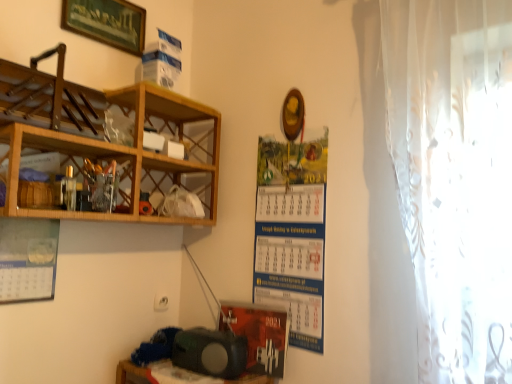
Question: From a real-world perspective, is wooden at left, placed as the second shelf when sorted from bottom to top, located beneath matte black speaker at lower center?

Choices:
 (A) yes
 (B) no

Answer: (B)

Question: From a real-world perspective, is wooden at left, placed as the second shelf when sorted from bottom to top, physically above matte black speaker at lower center?

Choices:
 (A) yes
 (B) no

Answer: (A)

Question: Is wooden at left, placed as the second shelf when sorted from bottom to top, turned away from matte black speaker at lower center?

Choices:
 (A) yes
 (B) no

Answer: (B)

Question: Does wooden at left, the first shelf in the top-to-bottom sequence, have a larger size compared to matte black speaker at lower center?

Choices:
 (A) yes
 (B) no

Answer: (A)

Question: Is wooden at left, the first shelf in the top-to-bottom sequence, shorter than matte black speaker at lower center?

Choices:
 (A) yes
 (B) no

Answer: (B)

Question: Can matte black speaker at lower center be found inside wooden at left, the first shelf in the top-to-bottom sequence?

Choices:
 (A) no
 (B) yes

Answer: (A)

Question: Would you say wooden at left, the 1th shelf ordered from the bottom, is a long distance from wooden framed picture at upper left?

Choices:
 (A) no
 (B) yes

Answer: (A)

Question: From a real-world perspective, is wooden at left, the 1th shelf ordered from the bottom, positioned over wooden framed picture at upper left based on gravity?

Choices:
 (A) yes
 (B) no

Answer: (B)

Question: Is wooden at left, the 1th shelf ordered from the bottom, taller than wooden framed picture at upper left?

Choices:
 (A) yes
 (B) no

Answer: (A)

Question: Can wooden framed picture at upper left be found inside wooden at left, the 1th shelf ordered from the bottom?

Choices:
 (A) no
 (B) yes

Answer: (A)

Question: From a real-world perspective, is wooden at left, the 2th shelf positioned from the top, beneath wooden framed picture at upper left?

Choices:
 (A) yes
 (B) no

Answer: (A)

Question: Considering the relative sizes of wooden at left, the 1th shelf ordered from the bottom, and wooden framed picture at upper left in the image provided, is wooden at left, the 1th shelf ordered from the bottom, wider than wooden framed picture at upper left?

Choices:
 (A) yes
 (B) no

Answer: (A)

Question: Can you confirm if matte black speaker at lower center is positioned to the right of matte black speaker at lower center?

Choices:
 (A) yes
 (B) no

Answer: (A)